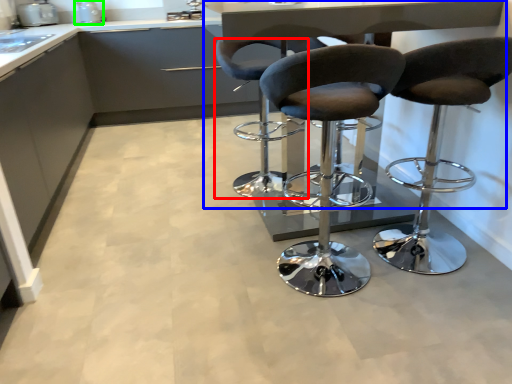
Question: Considering the real-world distances, which object is farthest from chair (highlighted by a red box)? table (highlighted by a blue box) or appliance (highlighted by a green box)?

Choices:
 (A) table
 (B) appliance

Answer: (B)